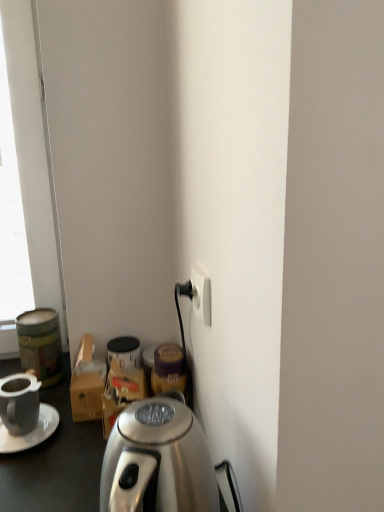
The image size is (384, 512). What do you see at coordinates (41, 344) in the screenshot?
I see `metallic green canister at left` at bounding box center [41, 344].

What is the approximate height of matte black mug at lower left?

matte black mug at lower left is 10.20 centimeters tall.

At what (x,y) coordinates should I click in order to perform the action: click on matte black mug at lower left. Please return your answer as a coordinate pair (x, y). Looking at the image, I should click on (19, 403).

This screenshot has width=384, height=512. I want to click on white matte saucer at left, so click(x=30, y=432).

What do you see at coordinates (30, 432) in the screenshot?
I see `white matte saucer at left` at bounding box center [30, 432].

Find the location of a particular element. This screenshot has width=384, height=512. white plastic power outlet at lower right is located at coordinates (201, 295).

Considering the relative sizes of matte black mug at lower left and white matte saucer at left in the image provided, is matte black mug at lower left thinner than white matte saucer at left?

Indeed, matte black mug at lower left has a lesser width compared to white matte saucer at left.

Is matte black mug at lower left at the left side of white matte saucer at left?

Indeed, matte black mug at lower left is positioned on the left side of white matte saucer at left.

Is point (18, 406) closer or farther from the camera than point (46, 437)?

Clearly, point (18, 406) is closer to the camera than point (46, 437).

Would you say matte black mug at lower left is outside white matte saucer at left?

Indeed, matte black mug at lower left is completely outside white matte saucer at left.

Is white matte saucer at left located within metallic green canister at left?

No, white matte saucer at left is not inside metallic green canister at left.

Between metallic green canister at left and white matte saucer at left, which one has smaller size?

Smaller between the two is white matte saucer at left.

From a real-world perspective, does metallic green canister at left stand above white matte saucer at left?

Yes.

What's the angular difference between metallic green canister at left and white matte saucer at left's facing directions?

There is a 11.6-degree angle between the facing directions of metallic green canister at left and white matte saucer at left.

Is metallic green canister at left surrounding matte black mug at lower left?

No, matte black mug at lower left is located outside of metallic green canister at left.

In the image, is metallic green canister at left positioned in front of or behind matte black mug at lower left?

Visually, metallic green canister at left is located behind matte black mug at lower left.

Is metallic green canister at left wider or thinner than matte black mug at lower left?

Clearly, metallic green canister at left has more width compared to matte black mug at lower left.

How far apart are metallic green canister at left and matte black mug at lower left?

The distance of metallic green canister at left from matte black mug at lower left is 5.10 inches.

In the scene shown: Is white matte saucer at left positioned far away from metallic green canister at left?

white matte saucer at left is actually quite close to metallic green canister at left.

Where is `saucer that appears on the right of metallic green canister at left`? This screenshot has height=512, width=384. saucer that appears on the right of metallic green canister at left is located at coordinates (30, 432).

From the image's perspective, does white matte saucer at left appear higher than metallic green canister at left?

No.

From the picture: Could metallic green canister at left be considered to be inside white matte saucer at left?

No, metallic green canister at left is not a part of white matte saucer at left.

The image size is (384, 512). Find the location of `power outlet above the matte black mug at lower left (from a real-world perspective)`. power outlet above the matte black mug at lower left (from a real-world perspective) is located at coordinates pos(201,295).

Consider the image. Is matte black mug at lower left inside or outside of white plastic power outlet at lower right?

matte black mug at lower left cannot be found inside white plastic power outlet at lower right.

From the image's perspective, which object appears higher, matte black mug at lower left or white plastic power outlet at lower right?

From the image's view, white plastic power outlet at lower right is above.

Could you tell me if white plastic power outlet at lower right is turned towards metallic green canister at left?

No, white plastic power outlet at lower right does not turn towards metallic green canister at left.

Does white plastic power outlet at lower right contain metallic green canister at left?

No, metallic green canister at left is located outside of white plastic power outlet at lower right.

In terms of height, does white plastic power outlet at lower right look taller or shorter compared to metallic green canister at left?

Considering their sizes, white plastic power outlet at lower right has less height than metallic green canister at left.

Locate an element on the screen. The width and height of the screenshot is (384, 512). beverage below the white plastic power outlet at lower right (from a real-world perspective) is located at coordinates (41, 344).

Is white matte saucer at left inside white plastic power outlet at lower right?

No.

Is white plastic power outlet at lower right facing towards white matte saucer at left?

No.

Considering the positions of point (193, 305) and point (45, 433), is point (193, 305) closer or farther from the camera than point (45, 433)?

Point (193, 305) is positioned closer to the camera compared to point (45, 433).

Is white plastic power outlet at lower right bigger or smaller than white matte saucer at left?

Considering their sizes, white plastic power outlet at lower right takes up less space than white matte saucer at left.

The width and height of the screenshot is (384, 512). What are the coordinates of `saucer to the right of matte black mug at lower left` in the screenshot? It's located at (30, 432).

Identify the location of beverage lying behind the white matte saucer at left. This screenshot has height=512, width=384. (41, 344).

When comparing their distances from white matte saucer at left, does metallic green canister at left or matte black mug at lower left seem further?

Among the two, metallic green canister at left is located further to white matte saucer at left.

Which object lies nearer to the anchor point metallic green canister at left, matte black mug at lower left or white matte saucer at left?

matte black mug at lower left is closer to metallic green canister at left.

Considering their positions, is white plastic power outlet at lower right positioned closer to metallic green canister at left than white matte saucer at left?

white matte saucer at left.

Considering their positions, is matte black mug at lower left positioned closer to white plastic power outlet at lower right than metallic green canister at left?

Based on the image, matte black mug at lower left appears to be nearer to white plastic power outlet at lower right.

From the image, which object appears to be farther from metallic green canister at left, white matte saucer at left or white plastic power outlet at lower right?

Based on the image, white plastic power outlet at lower right appears to be further to metallic green canister at left.

Estimate the real-world distances between objects in this image. Which object is closer to matte black mug at lower left, white plastic power outlet at lower right or metallic green canister at left?

Based on the image, metallic green canister at left appears to be nearer to matte black mug at lower left.

Looking at the image, which one is located closer to white plastic power outlet at lower right, matte black mug at lower left or white matte saucer at left?

matte black mug at lower left is positioned closer to the anchor white plastic power outlet at lower right.

Which object lies nearer to the anchor point white plastic power outlet at lower right, white matte saucer at left or matte black mug at lower left?

The object closer to white plastic power outlet at lower right is matte black mug at lower left.

The height and width of the screenshot is (512, 384). I want to click on saucer located between matte black mug at lower left and white plastic power outlet at lower right in the left-right direction, so click(30, 432).

Find the location of a particular element. saucer located between matte black mug at lower left and metallic green canister at left in the depth direction is located at coordinates (30, 432).

Locate an element on the screen. This screenshot has height=512, width=384. coffee cup located between metallic green canister at left and white plastic power outlet at lower right in the left-right direction is located at coordinates (19, 403).

Find the location of `saucer between metallic green canister at left and white plastic power outlet at lower right from left to right`. saucer between metallic green canister at left and white plastic power outlet at lower right from left to right is located at coordinates (30, 432).